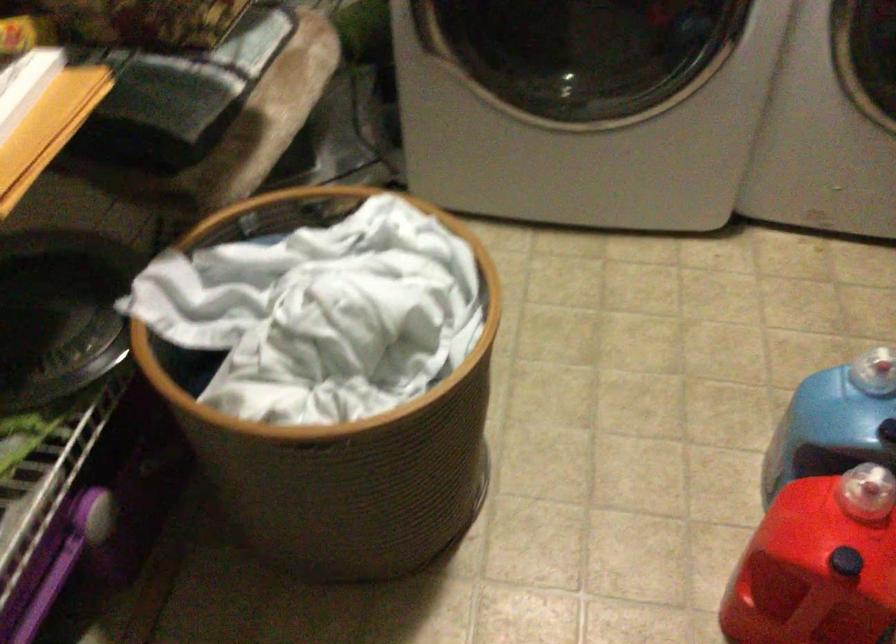
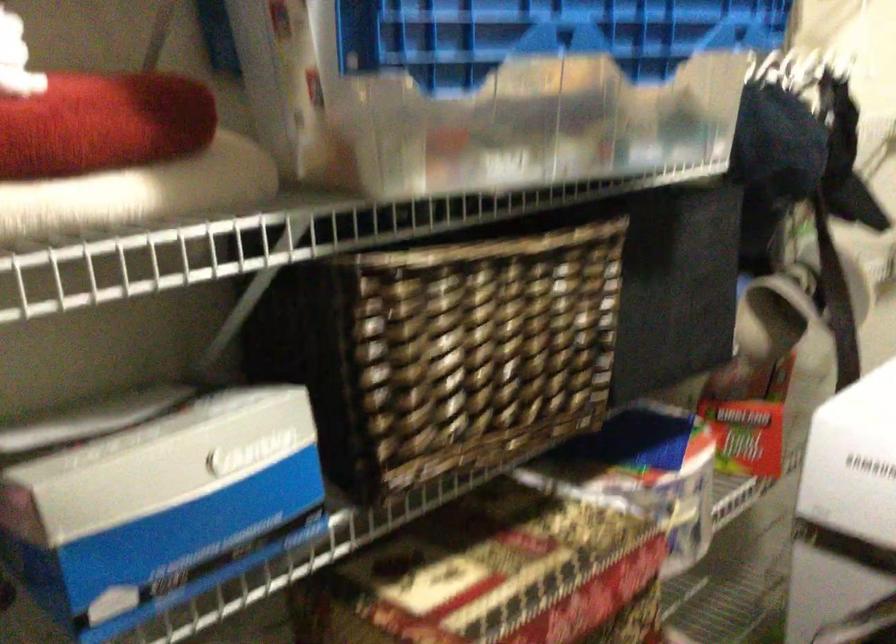
Based on the continuous images, in which direction is the camera rotating?

The camera's rotation is toward left-up.